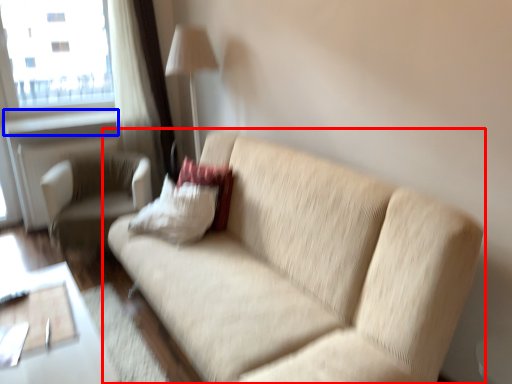
Question: Among these objects, which one is nearest to the camera, studio couch (highlighted by a red box) or window sill (highlighted by a blue box)?

Choices:
 (A) studio couch
 (B) window sill

Answer: (A)